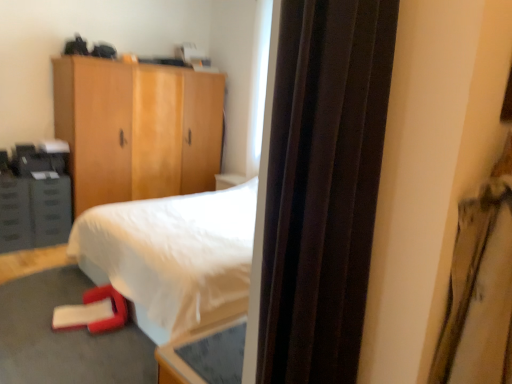
You are a GUI agent. You are given a task and a screenshot of the screen. Output one action in this format:
    pyautogui.click(x=<x>, y=<y>)
    Task: Click on the wooden cabinet at upper left
    The width and height of the screenshot is (512, 384).
    Given the screenshot: What is the action you would take?
    pyautogui.click(x=137, y=129)

The image size is (512, 384). Find the location of `wooden cabinet at upper left`. wooden cabinet at upper left is located at coordinates [x=137, y=129].

Does matte gray cabinet at left lie behind satin brown curtain at right?

Yes, it is.

From a real-world perspective, is matte gray cabinet at left on top of satin brown curtain at right?

No, from a real-world perspective, matte gray cabinet at left is not over satin brown curtain at right

Who is bigger, matte gray cabinet at left or satin brown curtain at right?

Bigger between the two is matte gray cabinet at left.

Considering the positions of points (10, 227) and (355, 222), is point (10, 227) farther from camera compared to point (355, 222)?

Yes, point (10, 227) is behind point (355, 222).

Is satin brown curtain at right placed right next to metallic gray drawer at left?

They are not placed beside each other.

Considering the sizes of objects satin brown curtain at right and metallic gray drawer at left in the image provided, who is shorter, satin brown curtain at right or metallic gray drawer at left?

metallic gray drawer at left is shorter.

Considering the relative sizes of satin brown curtain at right and metallic gray drawer at left in the image provided, is satin brown curtain at right smaller than metallic gray drawer at left?

Indeed, satin brown curtain at right has a smaller size compared to metallic gray drawer at left.

From a real-world perspective, does metallic gray drawer at left stand above satin brown curtain at right?

No, from a real-world perspective, metallic gray drawer at left is not above satin brown curtain at right.

In order to click on drawer located on the left of satin brown curtain at right in this screenshot , I will do `click(14, 214)`.

Considering the sizes of objects metallic gray drawer at left and satin brown curtain at right in the image provided, who is taller, metallic gray drawer at left or satin brown curtain at right?

satin brown curtain at right is taller.

From the image's perspective, relative to satin brown curtain at right, is metallic gray drawer at left above or below?

Based on their image positions, metallic gray drawer at left is located beneath satin brown curtain at right.

The height and width of the screenshot is (384, 512). In order to click on drawer in front of the wooden cabinet at upper left in this screenshot , I will do `click(14, 214)`.

In the scene shown: Is metallic gray drawer at left shorter than wooden cabinet at upper left?

Yes.

Looking at this image, which point is more distant from viewer, (11, 225) or (170, 168)?

The point (170, 168) is farther.

Considering the sizes of objects satin brown curtain at right and wooden cabinet at upper left in the image provided, who is taller, satin brown curtain at right or wooden cabinet at upper left?

wooden cabinet at upper left.

Does satin brown curtain at right appear on the left side of wooden cabinet at upper left?

Incorrect, satin brown curtain at right is not on the left side of wooden cabinet at upper left.

Is satin brown curtain at right directly adjacent to wooden cabinet at upper left?

No, satin brown curtain at right is not in contact with wooden cabinet at upper left.

Between point (69, 75) and point (10, 208), which one is positioned behind?

The point (69, 75) is farther from the camera.

Is wooden cabinet at upper left positioned beyond the bounds of metallic gray drawer at left?

Yes, wooden cabinet at upper left is not within metallic gray drawer at left.

Can you confirm if wooden cabinet at upper left is wider than metallic gray drawer at left?

Yes, wooden cabinet at upper left is wider than metallic gray drawer at left.

Is wooden cabinet at upper left taller or shorter than metallic gray drawer at left?

Considering their sizes, wooden cabinet at upper left has more height than metallic gray drawer at left.

From the image's perspective, which object appears higher, satin brown curtain at right or matte gray cabinet at left?

From the image's view, satin brown curtain at right is above.

Between satin brown curtain at right and matte gray cabinet at left, which one has more height?

→ satin brown curtain at right.

The height and width of the screenshot is (384, 512). I want to click on cabinetry below the satin brown curtain at right (from the image's perspective), so click(34, 213).

Does satin brown curtain at right contain matte gray cabinet at left?

No, matte gray cabinet at left is not inside satin brown curtain at right.

At what (x,y) coordinates should I click in order to perform the action: click on screen door located in front of the matte gray cabinet at left. Please return your answer as a coordinate pair (x, y). This screenshot has height=384, width=512. Looking at the image, I should click on (323, 186).

You are a GUI agent. You are given a task and a screenshot of the screen. Output one action in this format:
    pyautogui.click(x=<x>, y=<y>)
    Task: Click on the drawer that is below the satin brown curtain at right (from the image's perspective)
    
    Given the screenshot: What is the action you would take?
    pyautogui.click(x=14, y=214)

Estimate the real-world distances between objects in this image. Which object is further from satin brown curtain at right, wooden cabinet at upper left or metallic gray drawer at left?

wooden cabinet at upper left lies further to satin brown curtain at right than the other object.

Based on their spatial positions, is satin brown curtain at right or wooden cabinet at upper left closer to matte gray cabinet at left?

wooden cabinet at upper left.

Looking at the image, which one is located further to metallic gray drawer at left, satin brown curtain at right or matte gray cabinet at left?

Among the two, satin brown curtain at right is located further to metallic gray drawer at left.

Which object lies nearer to the anchor point satin brown curtain at right, matte gray cabinet at left or wooden cabinet at upper left?

Among the two, matte gray cabinet at left is located nearer to satin brown curtain at right.

Estimate the real-world distances between objects in this image. Which object is closer to wooden cabinet at upper left, satin brown curtain at right or matte gray cabinet at left?

Based on the image, matte gray cabinet at left appears to be nearer to wooden cabinet at upper left.

When comparing their distances from matte gray cabinet at left, does satin brown curtain at right or metallic gray drawer at left seem closer?

Based on the image, metallic gray drawer at left appears to be nearer to matte gray cabinet at left.

Which object lies further to the anchor point metallic gray drawer at left, matte gray cabinet at left or satin brown curtain at right?

The object further to metallic gray drawer at left is satin brown curtain at right.

Considering their positions, is matte gray cabinet at left positioned closer to metallic gray drawer at left than wooden cabinet at upper left?

Based on the image, matte gray cabinet at left appears to be nearer to metallic gray drawer at left.

The image size is (512, 384). I want to click on drawer between satin brown curtain at right and wooden cabinet at upper left in the front-back direction, so click(14, 214).

Image resolution: width=512 pixels, height=384 pixels. What are the coordinates of `cabinetry located between metallic gray drawer at left and wooden cabinet at upper left in the left-right direction` in the screenshot? It's located at click(34, 213).

Find the location of a particular element. drawer between satin brown curtain at right and matte gray cabinet at left in the front-back direction is located at coordinates (14, 214).

The height and width of the screenshot is (384, 512). Find the location of `cupboard between satin brown curtain at right and matte gray cabinet at left in the front-back direction`. cupboard between satin brown curtain at right and matte gray cabinet at left in the front-back direction is located at coordinates (137, 129).